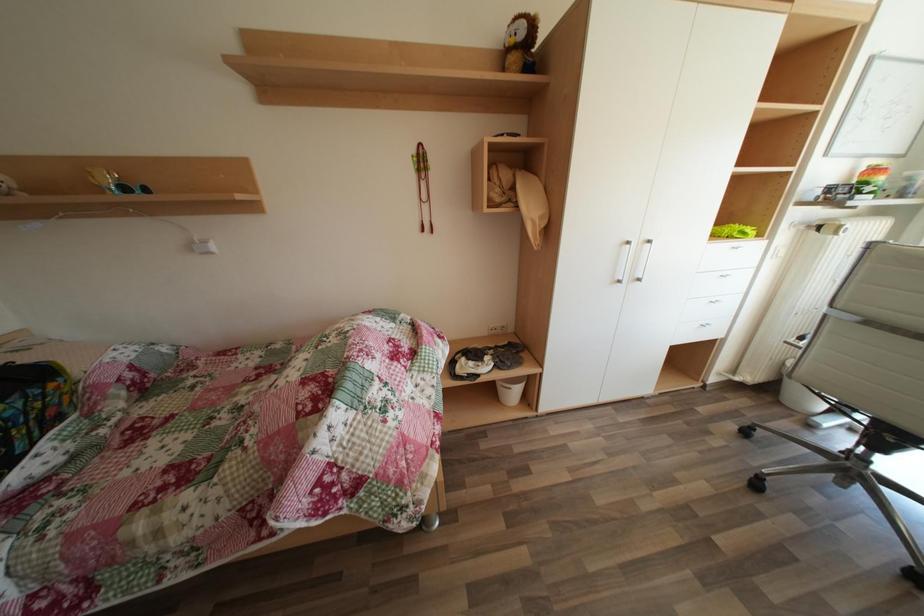
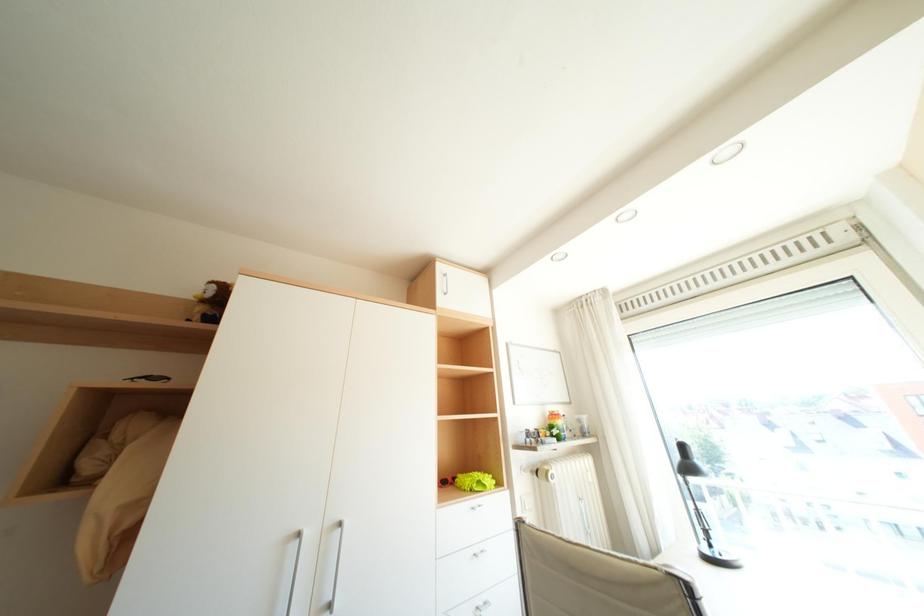
Based on the continuous images, in which direction is the camera rotating?

The camera rotated toward right-up.